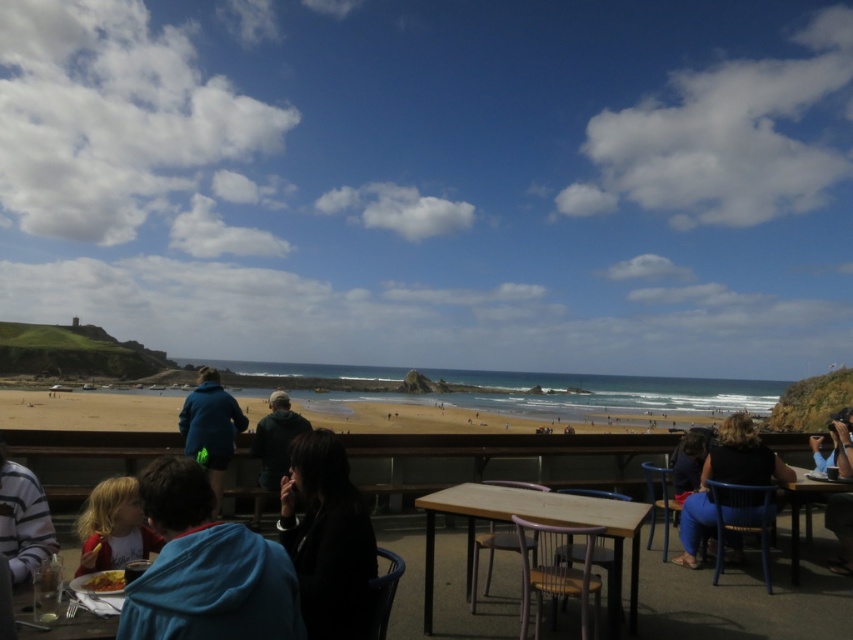
Between point (257, 481) and point (71, 620), which one is positioned behind?

Positioned behind is point (257, 481).

What do you see at coordinates (276, 440) in the screenshot? I see `dark green hoodie at center` at bounding box center [276, 440].

At what (x,y) coordinates should I click in order to perform the action: click on dark green hoodie at center. Please return your answer as a coordinate pair (x, y). Looking at the image, I should click on (276, 440).

Between blue hoodie at lower left and yellowish matte plate at lower left, which one has less height?

yellowish matte plate at lower left

Does blue hoodie at lower left appear on the left side of yellowish matte plate at lower left?

No, blue hoodie at lower left is not to the left of yellowish matte plate at lower left.

Is point (164, 486) farther from viewer compared to point (106, 573)?

That is False.

At what (x,y) coordinates should I click in order to perform the action: click on blue hoodie at lower left. Please return your answer as a coordinate pair (x, y). The width and height of the screenshot is (853, 640). Looking at the image, I should click on (206, 568).

Can you confirm if black matte jacket at center is positioned below blue fabric jacket at center?

No, black matte jacket at center is not below blue fabric jacket at center.

Can you confirm if black matte jacket at center is bigger than blue fabric jacket at center?

Incorrect, black matte jacket at center is not larger than blue fabric jacket at center.

I want to click on black matte jacket at center, so click(x=328, y=538).